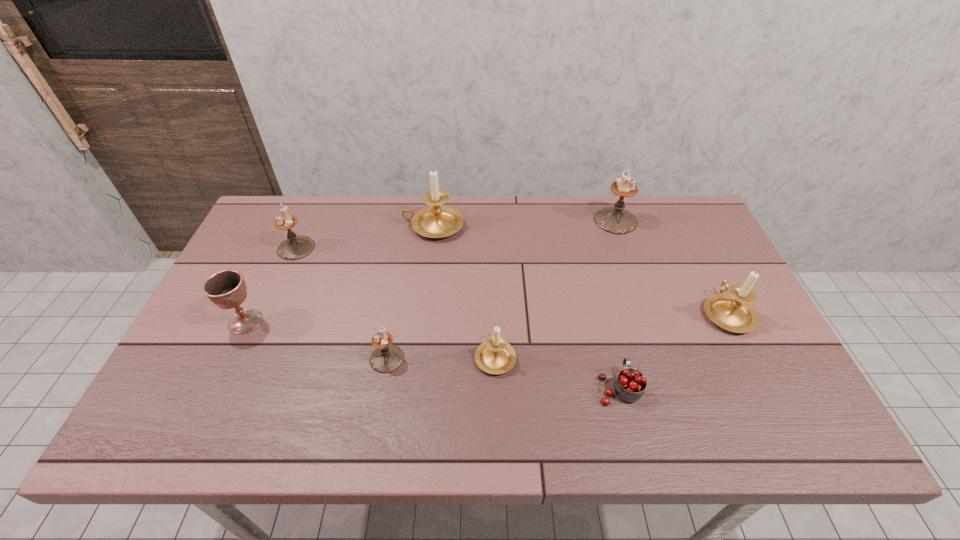
The width and height of the screenshot is (960, 540). Find the location of `the sixth closest object to the rightmost candle holder`. the sixth closest object to the rightmost candle holder is located at coordinates (295, 247).

Locate which object is the seventh closest to the smallest purple candle holder. Please provide its 2D coordinates. Your answer should be formatted as a tuple, i.e. [(x, y)], where the tuple contains the x and y coordinates of a point satisfying the conditions above.

[(732, 312)]

This screenshot has height=540, width=960. What are the coordinates of `candle holder that stands as the second closest to the rightmost candle holder` in the screenshot? It's located at (495, 356).

Where is `candle holder object that ranks as the second closest to the shortest object`? candle holder object that ranks as the second closest to the shortest object is located at coordinates (732, 312).

Where is `the closest purple candle holder to the second beige candle holder from left to right`? This screenshot has width=960, height=540. the closest purple candle holder to the second beige candle holder from left to right is located at coordinates (388, 357).

Identify which purple candle holder is located as the second nearest to the second beige candle holder from left to right. Please provide its 2D coordinates. Your answer should be formatted as a tuple, i.e. [(x, y)], where the tuple contains the x and y coordinates of a point satisfying the conditions above.

[(616, 220)]

At what (x,y) coordinates should I click in order to perform the action: click on beige candle holder that stands as the second closest to the cherry. Please return your answer as a coordinate pair (x, y). The width and height of the screenshot is (960, 540). Looking at the image, I should click on (732, 312).

Find the location of a particular element. This screenshot has height=540, width=960. beige candle holder that is the second closest to the second biggest purple candle holder is located at coordinates (495, 356).

At what (x,y) coordinates should I click in order to perform the action: click on blank area in the image that satisfies the following two spatial constraints: 1. on the front side of the smallest purple candle holder; 2. on the left side of the second biggest purple candle holder. Please return your answer as a coordinate pair (x, y). Image resolution: width=960 pixels, height=540 pixels. Looking at the image, I should click on (249, 359).

Find the location of a particular element. The height and width of the screenshot is (540, 960). free space that satisfies the following two spatial constraints: 1. with a handle on the side of the farthest beige candle holder; 2. on the handle side of the red cherry is located at coordinates (415, 388).